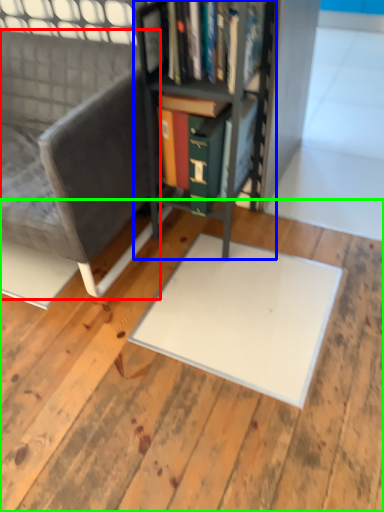
Question: Which object is the farthest from chair (highlighted by a red box)? Choose among these: bookcase (highlighted by a blue box) or plywood (highlighted by a green box).

Choices:
 (A) bookcase
 (B) plywood

Answer: (B)